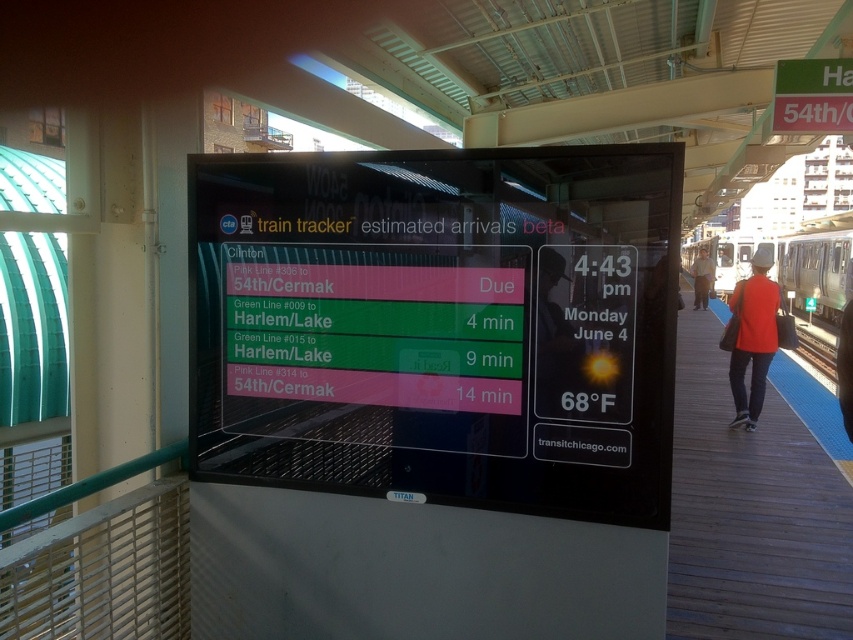
Is wooden platform at right to the left of red shirt at right from the viewer's perspective?

Indeed, wooden platform at right is positioned on the left side of red shirt at right.

Can you confirm if wooden platform at right is positioned above red shirt at right?

Actually, wooden platform at right is below red shirt at right.

Is point (825, 593) more distant than point (693, 300)?

No, (825, 593) is in front of (693, 300).

In order to click on wooden platform at right in this screenshot , I will do `click(755, 502)`.

Between wooden platform at right and matte red shirt at center, which one is positioned lower?

wooden platform at right is lower down.

Between point (724, 364) and point (759, 387), which one is positioned behind?

The point (724, 364) is behind.

Is point (699, 609) more distant than point (773, 323)?

No, it is not.

I want to click on wooden platform at right, so click(x=755, y=502).

Does silver metallic train at right come behind red shirt at right?

No, silver metallic train at right is closer to the viewer.

The image size is (853, 640). I want to click on silver metallic train at right, so click(x=815, y=273).